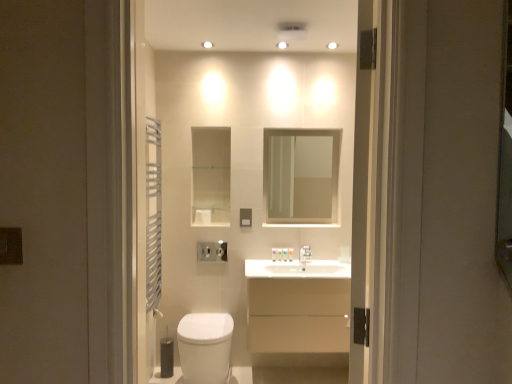
Question: Does white matte toilet paper at right, the second toilet paper viewed from the left, have a lesser height compared to beige matte cabinet at center?

Choices:
 (A) no
 (B) yes

Answer: (B)

Question: Could you tell me if white matte toilet paper at right, which is counted as the 2th toilet paper, starting from the top, is turned towards beige matte cabinet at center?

Choices:
 (A) no
 (B) yes

Answer: (A)

Question: From a real-world perspective, is white matte toilet paper at right, which is counted as the 2th toilet paper, starting from the top, on top of beige matte cabinet at center?

Choices:
 (A) no
 (B) yes

Answer: (B)

Question: Are white matte toilet paper at right, the second toilet paper viewed from the left, and beige matte cabinet at center located far from each other?

Choices:
 (A) no
 (B) yes

Answer: (A)

Question: Could beige matte cabinet at center be considered to be inside white matte toilet paper at right, which is counted as the 2th toilet paper, starting from the top?

Choices:
 (A) yes
 (B) no

Answer: (B)

Question: From the image's perspective, is clear glass mirror at upper center positioned above or below beige matte cabinet at center?

Choices:
 (A) above
 (B) below

Answer: (A)

Question: Visually, is clear glass mirror at upper center positioned to the left or to the right of beige matte cabinet at center?

Choices:
 (A) right
 (B) left

Answer: (A)

Question: Is clear glass mirror at upper center taller or shorter than beige matte cabinet at center?

Choices:
 (A) short
 (B) tall

Answer: (B)

Question: Relative to beige matte cabinet at center, is clear glass mirror at upper center in front or behind?

Choices:
 (A) behind
 (B) front

Answer: (A)

Question: Relative to white glossy toilet at center, is matte black switch at left, which is the first electric outlet in front-to-back order, in front or behind?

Choices:
 (A) front
 (B) behind

Answer: (B)

Question: Is matte black switch at left, the second electric outlet in the back-to-front sequence, to the left or to the right of white glossy toilet at center in the image?

Choices:
 (A) right
 (B) left

Answer: (B)

Question: Would you say matte black switch at left, arranged as the 2th electric outlet when viewed from the right, is inside or outside white glossy toilet at center?

Choices:
 (A) outside
 (B) inside

Answer: (A)

Question: Is matte black switch at left, the second electric outlet in the back-to-front sequence, taller or shorter than white glossy toilet at center?

Choices:
 (A) tall
 (B) short

Answer: (B)

Question: In terms of size, does matte gray electric outlet at center, the 1th electric outlet viewed from the back, appear bigger or smaller than white matte toilet paper at center, which is counted as the 2th toilet paper, starting from the bottom?

Choices:
 (A) small
 (B) big

Answer: (A)

Question: Would you say matte gray electric outlet at center, which is the first electric outlet in right-to-left order, is to the left or to the right of white matte toilet paper at center, which is counted as the 2th toilet paper, starting from the right, in the picture?

Choices:
 (A) left
 (B) right

Answer: (B)